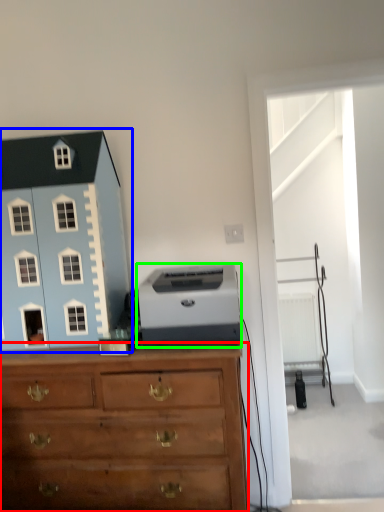
Question: Estimate the real-world distances between objects in this image. Which object is farther from chest of drawers (highlighted by a red box), toy (highlighted by a blue box) or printer (highlighted by a green box)?

Choices:
 (A) toy
 (B) printer

Answer: (A)